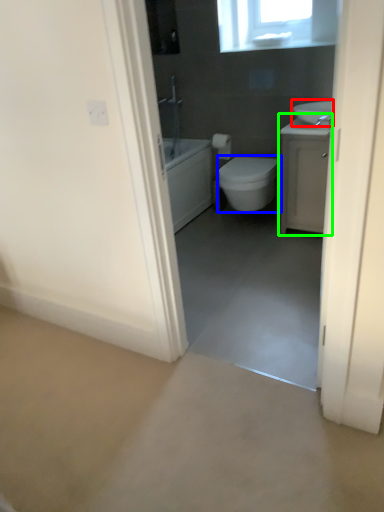
Question: Which is farther away from sink (highlighted by a red box)? bidet (highlighted by a blue box) or bathroom cabinet (highlighted by a green box)?

Choices:
 (A) bidet
 (B) bathroom cabinet

Answer: (A)